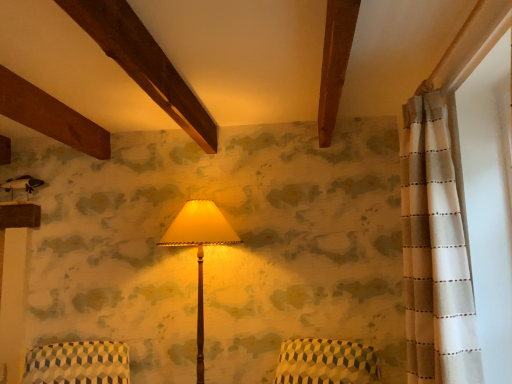
Question: Is patterned fabric armchair at lower left further to camera compared to white dotted fabric at right?

Choices:
 (A) no
 (B) yes

Answer: (B)

Question: Is white dotted fabric at right located within patterned fabric armchair at lower left?

Choices:
 (A) no
 (B) yes

Answer: (A)

Question: Considering the relative sizes of patterned fabric armchair at lower left and white dotted fabric at right in the image provided, is patterned fabric armchair at lower left taller than white dotted fabric at right?

Choices:
 (A) yes
 (B) no

Answer: (B)

Question: Does patterned fabric armchair at lower left have a greater width compared to white dotted fabric at right?

Choices:
 (A) yes
 (B) no

Answer: (A)

Question: Is patterned fabric armchair at lower left outside white dotted fabric at right?

Choices:
 (A) yes
 (B) no

Answer: (A)

Question: Is patterned fabric armchair at lower left thinner than white dotted fabric at right?

Choices:
 (A) yes
 (B) no

Answer: (B)

Question: Does wooden floor lamp at center contain white dotted fabric at right?

Choices:
 (A) yes
 (B) no

Answer: (B)

Question: Is wooden floor lamp at center shorter than white dotted fabric at right?

Choices:
 (A) yes
 (B) no

Answer: (B)

Question: Is wooden floor lamp at center further to the viewer compared to white dotted fabric at right?

Choices:
 (A) yes
 (B) no

Answer: (A)

Question: Could you tell me if wooden floor lamp at center is turned towards white dotted fabric at right?

Choices:
 (A) yes
 (B) no

Answer: (B)

Question: Is wooden floor lamp at center at the left side of white dotted fabric at right?

Choices:
 (A) no
 (B) yes

Answer: (B)

Question: From a real-world perspective, is wooden floor lamp at center on white dotted fabric at right?

Choices:
 (A) yes
 (B) no

Answer: (B)

Question: From the image's perspective, is white dotted fabric at right on top of patterned fabric armchair at lower left?

Choices:
 (A) no
 (B) yes

Answer: (B)